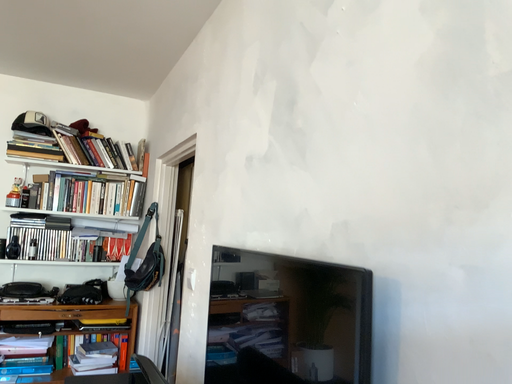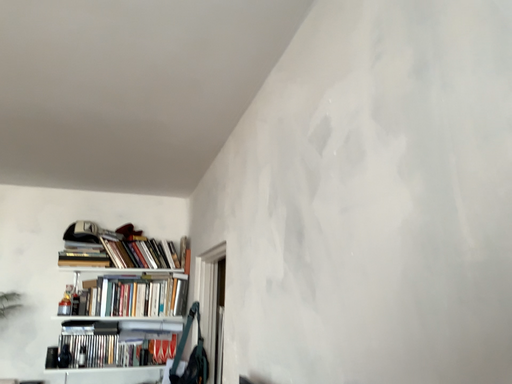
Question: How did the camera likely rotate when shooting the video?

Choices:
 (A) rotated upward
 (B) rotated downward

Answer: (A)